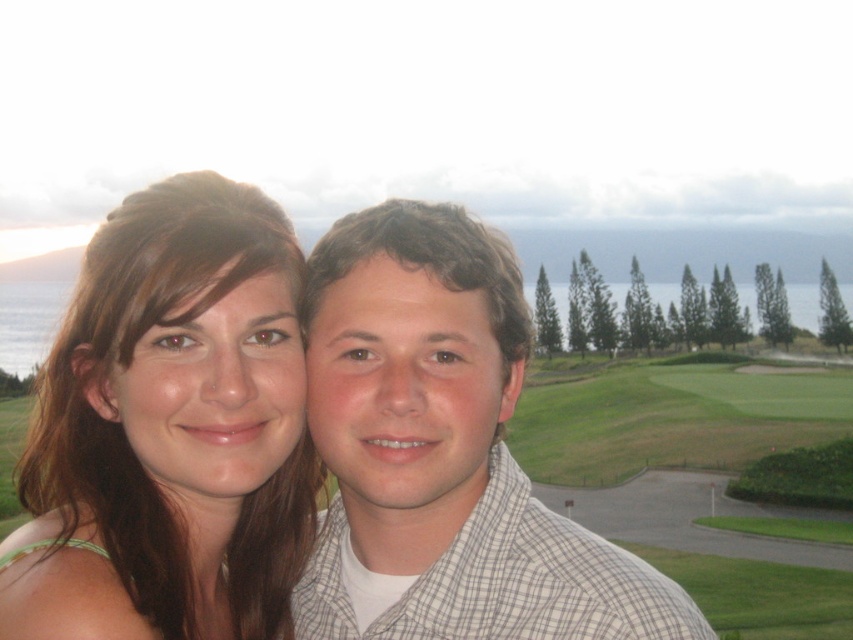
Describe the element at coordinates (169, 429) in the screenshot. I see `matte brown hair at center` at that location.

Who is more distant from viewer, (62, 563) or (424, 250)?

Positioned behind is point (424, 250).

Identify the location of matte brown hair at center. This screenshot has height=640, width=853. (x=169, y=429).